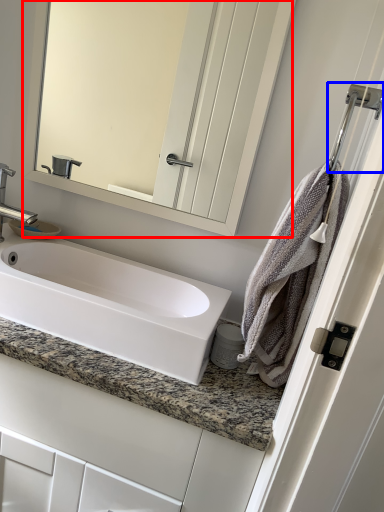
Question: Which point is closer to the camera, mirror (highlighted by a red box) or shower (highlighted by a blue box)?

Choices:
 (A) mirror
 (B) shower

Answer: (B)